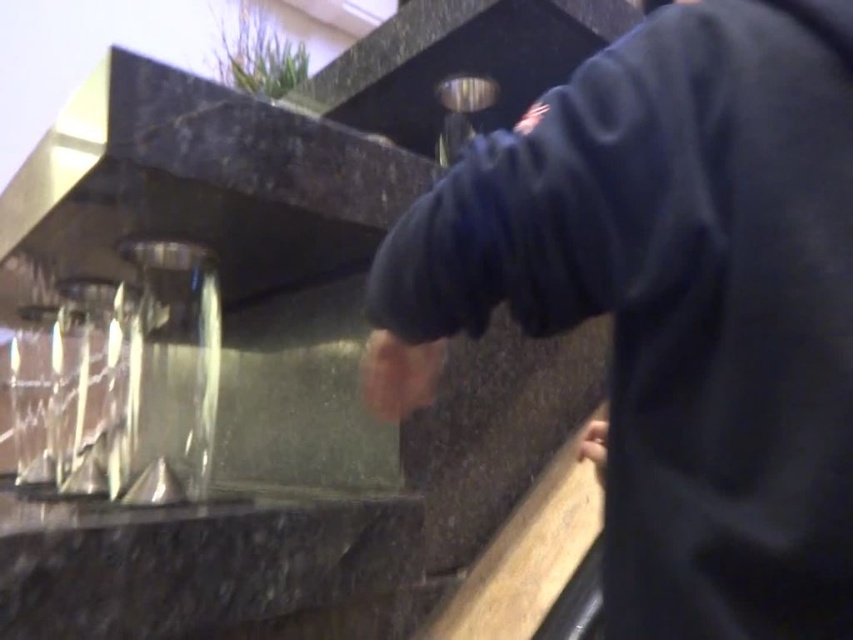
From the picture: You are a photographer trying to capture the dark blue sweatshirt at center and the black marble counter at lower left in the same frame. Based on their sizes in the image, which object would appear larger in your photo?

The dark blue sweatshirt at center appears much larger than the black marble counter at lower left because it is much taller.

You are a photographer planning to take a portrait of the person in the dark blue sweatshirt at center. To avoid including the black marble counter at lower left in the photo, where should you position yourself relative to the counter?

The dark blue sweatshirt at center is located above the black marble counter at lower left. To avoid including the counter, position yourself above the counter so that the counter is out of frame while capturing the sweatshirt.

You are a photographer standing at a distance. You want to capture a clear photo of the dark blue sweatshirt at center without any blur. The camera you are using has a minimum focusing distance of 12 inches. Can you take the photo clearly?

The dark blue sweatshirt at center and viewer are 13.10 inches apart. Since the minimum focusing distance is 12 inches, the photographer can take a clear photo as the distance is within the camera range.